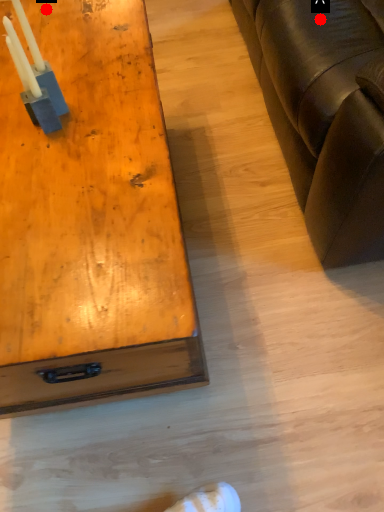
Question: Two points are circled on the image, labeled by A and B beside each circle. Which of the following is the farthest from the observer?

Choices:
 (A) A is further
 (B) B is further

Answer: (B)